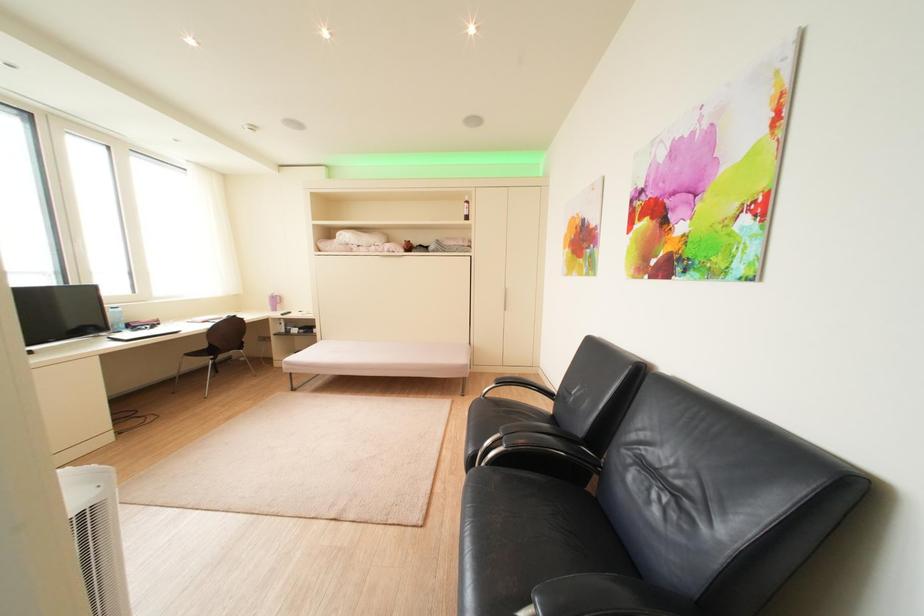
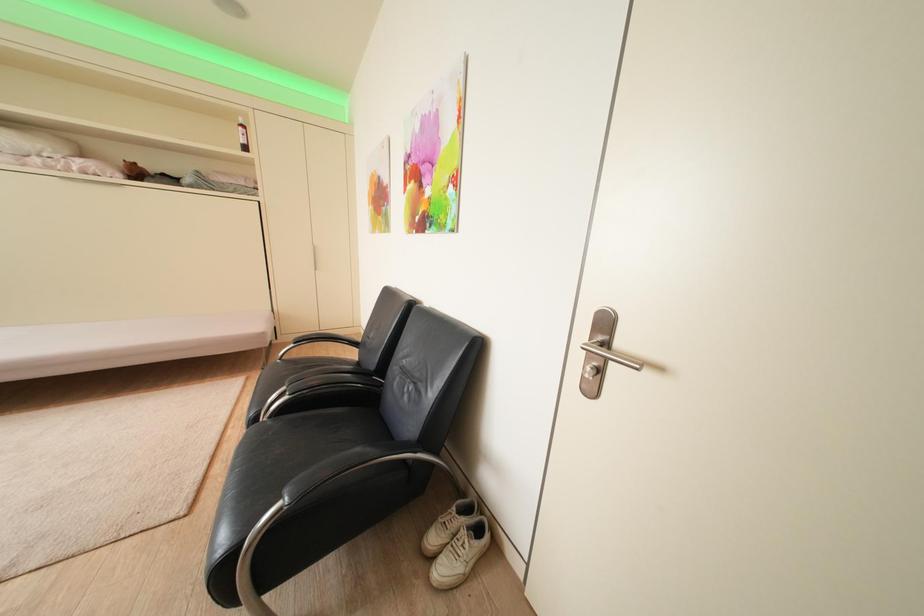
Question: The camera is either moving clockwise (left) or counter-clockwise (right) around the object. The first image is from the beginning of the video and the second image is from the end. Is the camera moving left or right when shooting the video?

Choices:
 (A) Left
 (B) Right

Answer: (A)